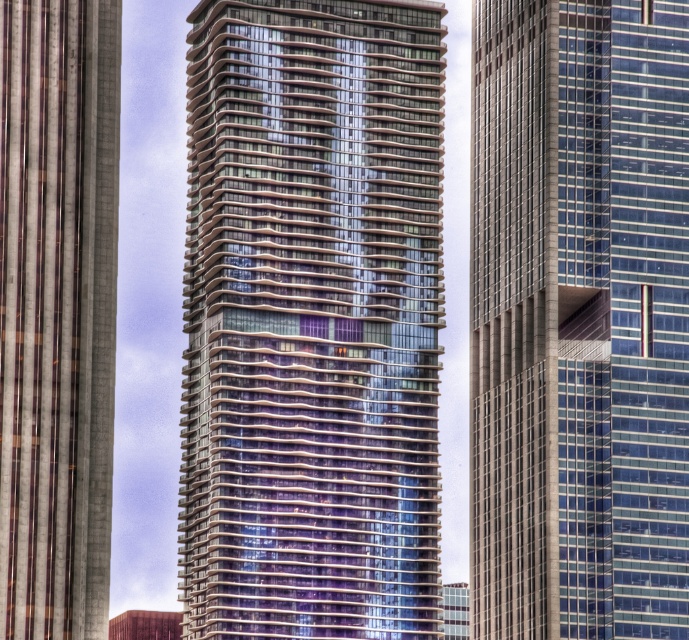
Question: Is glassy reflective skyscraper at center to the left of glassy reflective skyscraper at left from the viewer's perspective?

Choices:
 (A) no
 (B) yes

Answer: (A)

Question: Which point is closer to the camera taking this photo?

Choices:
 (A) (655, 602)
 (B) (358, 132)
 (C) (76, 442)

Answer: (C)

Question: Does glassy reflective skyscraper at center have a lesser width compared to glassy steel skyscraper at center?

Choices:
 (A) no
 (B) yes

Answer: (A)

Question: Which object is positioned closest to the glassy steel skyscraper at center?

Choices:
 (A) glassy reflective skyscraper at left
 (B) glassy reflective skyscraper at center

Answer: (B)

Question: Which point is farther to the camera?

Choices:
 (A) glassy steel skyscraper at center
 (B) glassy reflective skyscraper at left

Answer: (A)

Question: Can you confirm if glassy steel skyscraper at center is positioned below glassy reflective skyscraper at left?

Choices:
 (A) yes
 (B) no

Answer: (A)